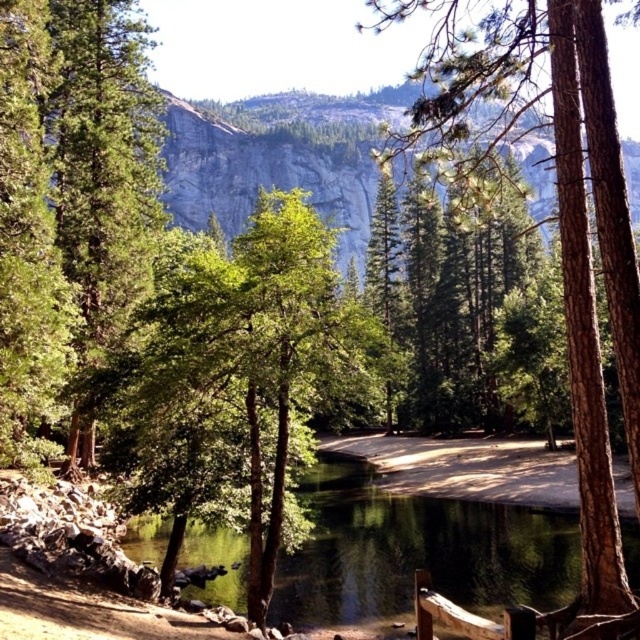
Looking at this image, you are standing at the wooden fence near the water and want to take a photo of the green textured tree at center. If your camera has a maximum focus range of 5 meters, will you be able to capture the tree clearly?

The green textured tree at center and camera are 5.83 meters apart. Since the distance exceeds the camera maximum focus range of 5 meters, you won not be able to capture the tree clearly.

You are standing on the wooden fence in the scene and want to look down at the green reflective water at center and the green textured tree at left. Which object is closer to your feet?

The green reflective water at center is closer to your feet because it is located below the green textured tree at left.

In the scene shown: You are an environmental scientist assessing the health of trees in this landscape. You notice the green textured tree at center and the green textured tree at left. Which tree would likely have a larger canopy area based on their sizes?

The green textured tree at center has a larger size compared to the green textured tree at left, so it would likely have a larger canopy area.